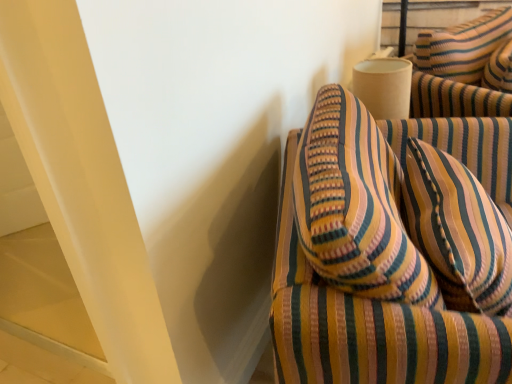
At what (x,y) coordinates should I click in order to perform the action: click on striped fabric pillow at right. Please return your answer as a coordinate pair (x, y). Looking at the image, I should click on (457, 231).

Describe the element at coordinates (457, 231) in the screenshot. I see `striped fabric pillow at right` at that location.

Identify the location of striped fabric armchair at right. (393, 250).

What do you see at coordinates (393, 250) in the screenshot? I see `striped fabric armchair at right` at bounding box center [393, 250].

Locate an element on the screen. striped fabric pillow at right is located at coordinates (457, 231).

Is striped fabric pillow at right to the left or to the right of striped fabric armchair at right in the image?

In the image, striped fabric pillow at right appears on the right side of striped fabric armchair at right.

Is striped fabric pillow at right closer to camera compared to striped fabric armchair at right?

No, it is behind striped fabric armchair at right.

Is point (450, 273) closer to camera compared to point (487, 120)?

Yes, it is in front of point (487, 120).

From the image's perspective, is striped fabric pillow at right beneath striped fabric armchair at right?

Incorrect, from the image's perspective, striped fabric pillow at right is higher than striped fabric armchair at right.

From a real-world perspective, which object rests below the other?

striped fabric armchair at right.

Looking at this image, considering the relative sizes of striped fabric pillow at right and striped fabric armchair at right in the image provided, is striped fabric pillow at right thinner than striped fabric armchair at right?

Indeed, striped fabric pillow at right has a lesser width compared to striped fabric armchair at right.

Can you confirm if striped fabric pillow at right is shorter than striped fabric armchair at right?

Yes, striped fabric pillow at right is shorter than striped fabric armchair at right.

Does striped fabric pillow at right have a smaller size compared to striped fabric armchair at right?

Correct, striped fabric pillow at right occupies less space than striped fabric armchair at right.

Do you think striped fabric pillow at right is within striped fabric armchair at right, or outside of it?

striped fabric pillow at right lies within the bounds of striped fabric armchair at right.

Is striped fabric pillow at right not close to striped fabric armchair at right?

striped fabric pillow at right is near striped fabric armchair at right, not far away.

Is striped fabric pillow at right looking in the opposite direction of striped fabric armchair at right?

Correct, striped fabric pillow at right is looking away from striped fabric armchair at right.

The image size is (512, 384). Identify the location of furniture lying below the striped fabric pillow at right (from the image's perspective). (393, 250).

Visually, is striped fabric armchair at right positioned to the left or to the right of striped fabric pillow at right?

From the image, it's evident that striped fabric armchair at right is to the left of striped fabric pillow at right.

Relative to striped fabric pillow at right, is striped fabric armchair at right in front or behind?

Clearly, striped fabric armchair at right is in front of striped fabric pillow at right.

Is point (344, 232) closer or farther from the camera than point (438, 253)?

Point (344, 232).

From the image's perspective, relative to striped fabric pillow at right, is striped fabric armchair at right above or below?

Based on their image positions, striped fabric armchair at right is located beneath striped fabric pillow at right.

Consider the image. From a real-world perspective, relative to striped fabric pillow at right, is striped fabric armchair at right vertically above or below?

striped fabric armchair at right is situated lower than striped fabric pillow at right in the real world.

Is striped fabric armchair at right thinner than striped fabric pillow at right?

No.

Can you confirm if striped fabric armchair at right is taller than striped fabric pillow at right?

Indeed, striped fabric armchair at right has a greater height compared to striped fabric pillow at right.

Who is bigger, striped fabric armchair at right or striped fabric pillow at right?

With larger size is striped fabric armchair at right.

Is striped fabric pillow at right inside striped fabric armchair at right?

Yes, striped fabric pillow at right is a part of striped fabric armchair at right.

Is striped fabric armchair at right touching striped fabric pillow at right?

Yes.

Is striped fabric armchair at right facing away from striped fabric pillow at right?

Yes, striped fabric armchair at right is positioned with its back facing striped fabric pillow at right.

How many degrees apart are the facing directions of striped fabric armchair at right and striped fabric pillow at right?

4.51 degrees.

Locate an element on the screen. This screenshot has height=384, width=512. pillow that is above the striped fabric armchair at right (from the image's perspective) is located at coordinates (457, 231).

Identify the location of pillow above the striped fabric armchair at right (from the image's perspective). (457, 231).

Where is `furniture below the striped fabric pillow at right (from the image's perspective)`? The height and width of the screenshot is (384, 512). furniture below the striped fabric pillow at right (from the image's perspective) is located at coordinates (393, 250).